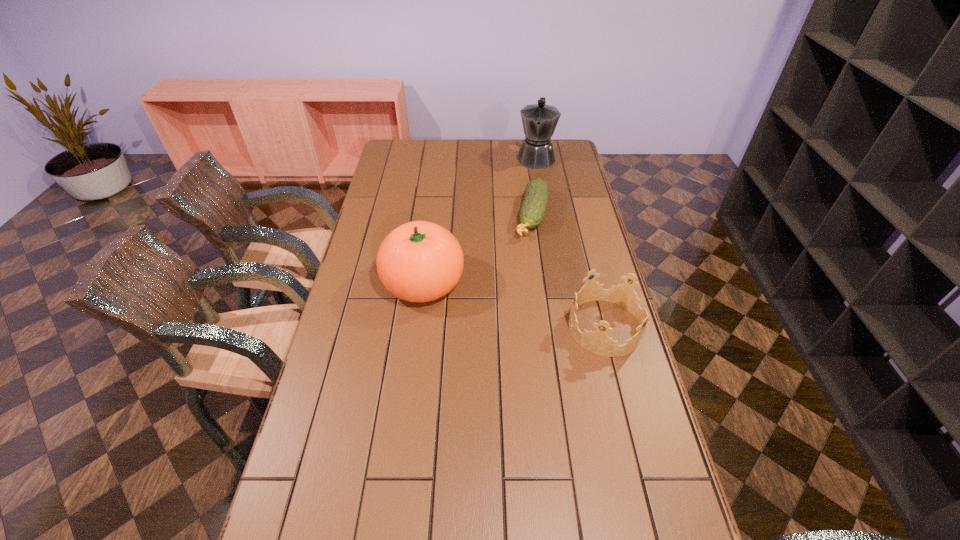
I want to click on vacant space on the desktop that is between the leftmost object and the tiara and is positioned at the blossom end of the third nearest object, so click(x=507, y=302).

The height and width of the screenshot is (540, 960). I want to click on vacant space on the desktop that is between the pumpkin and the third tallest object and is positioned at the spout of the coffeepot, so click(512, 304).